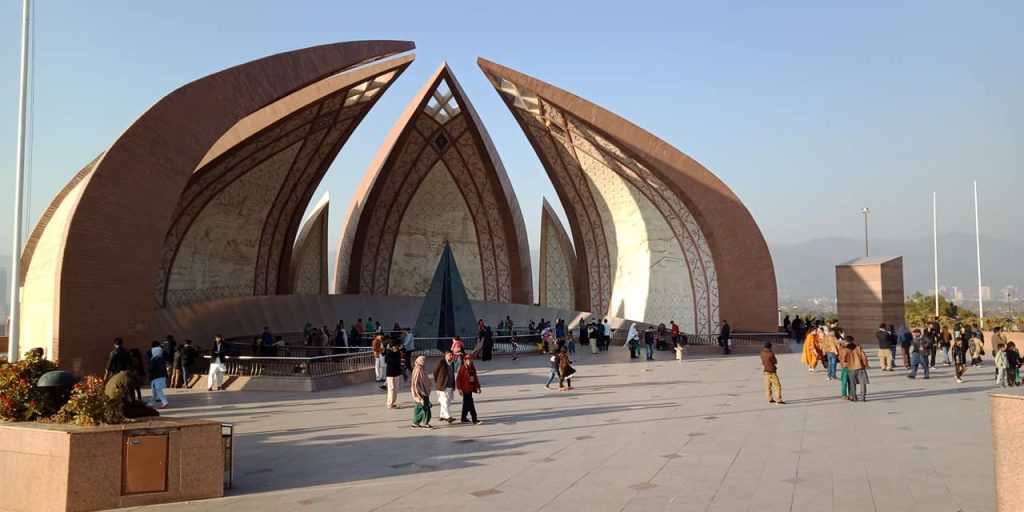
The width and height of the screenshot is (1024, 512). In order to click on plant in this screenshot , I will do tap(8, 373), tap(95, 411), tap(930, 323), tap(966, 310).